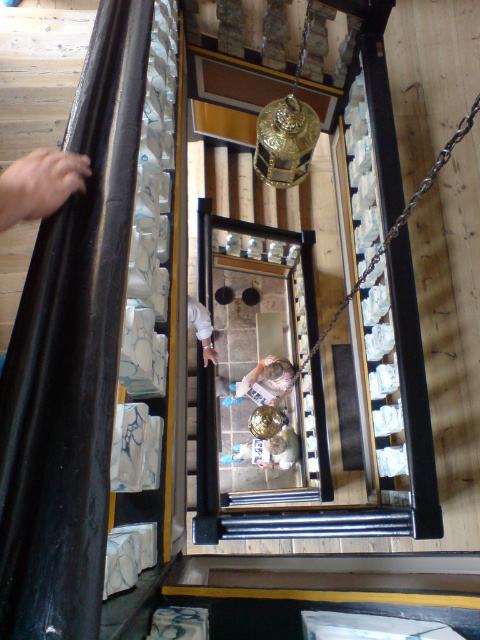
Looking at the scene from above, you see a smooth skin hand at upper left and a light brown fabric shirt at center. Which object is positioned more to the left side of the frame?

The smooth skin hand at upper left is positioned more to the left side of the frame than the light brown fabric shirt at center.